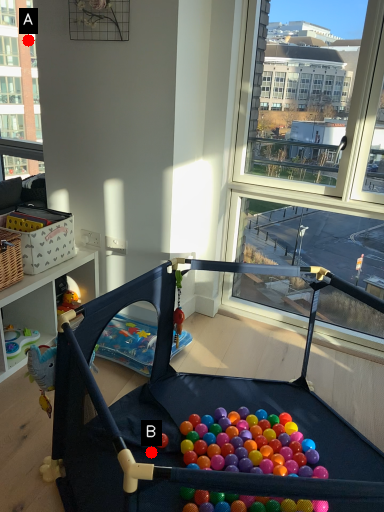
Question: Two points are circled on the image, labeled by A and B beside each circle. Which point is closer to the camera?

Choices:
 (A) A is closer
 (B) B is closer

Answer: (B)